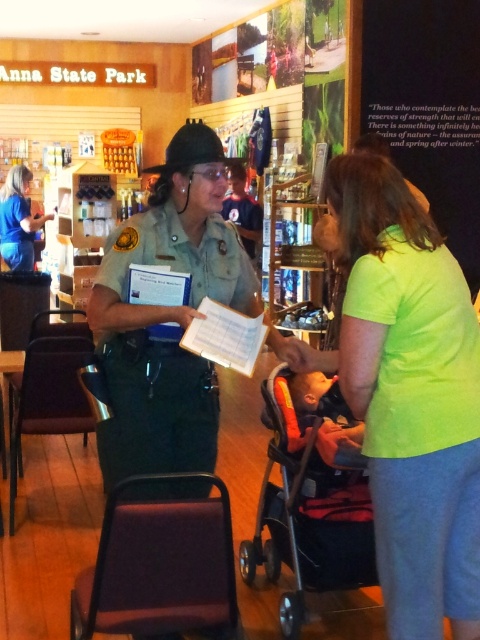
Where is `neon green shirt at center`? This screenshot has width=480, height=640. neon green shirt at center is located at coordinates (408, 396).

Where is `neon green shirt at center`? neon green shirt at center is located at coordinates (408, 396).

Is neon green shirt at center further to the viewer compared to black plastic baby carriage at lower center?

No.

Describe the element at coordinates (408, 396) in the screenshot. Image resolution: width=480 pixels, height=640 pixels. I see `neon green shirt at center` at that location.

Between point (350, 224) and point (312, 561), which one is positioned behind?

Point (312, 561)

You are a GUI agent. You are given a task and a screenshot of the screen. Output one action in this format:
    pyautogui.click(x=<x>, y=<y>)
    Task: Click on the neon green shirt at center
    
    Given the screenshot: What is the action you would take?
    pyautogui.click(x=408, y=396)

In the scene shown: Which of these two, neon green shirt at center or green uniform at center, stands taller?

neon green shirt at center is taller.

Between neon green shirt at center and green uniform at center, which one is positioned higher?

green uniform at center

Between point (371, 365) and point (149, 356), which one is positioned in front?

Point (371, 365) is more forward.

Image resolution: width=480 pixels, height=640 pixels. What are the coordinates of `neon green shirt at center` in the screenshot? It's located at (408, 396).